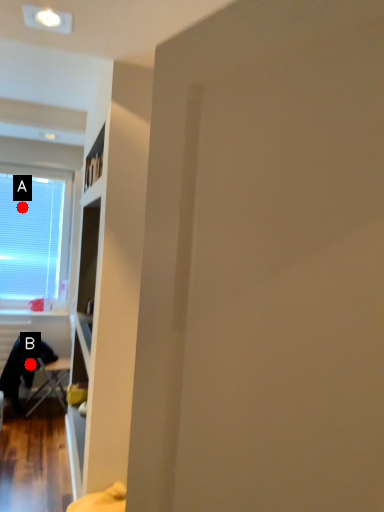
Question: Two points are circled on the image, labeled by A and B beside each circle. Among these points, which one is farthest from the camera?

Choices:
 (A) A is further
 (B) B is further

Answer: (A)